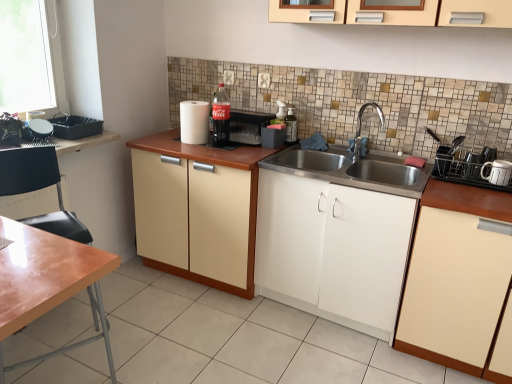
Question: Does matte plastic soda machine at center, the third appliance in the left-to-right sequence, have a lesser height compared to silver metallic faucet at center?

Choices:
 (A) no
 (B) yes

Answer: (B)

Question: Is matte plastic soda machine at center, the third appliance in the left-to-right sequence, to the left of silver metallic faucet at center from the viewer's perspective?

Choices:
 (A) yes
 (B) no

Answer: (A)

Question: From the image's perspective, is matte plastic soda machine at center, positioned as the fourth appliance in right-to-left order, below silver metallic faucet at center?

Choices:
 (A) no
 (B) yes

Answer: (A)

Question: Does matte plastic soda machine at center, positioned as the fourth appliance in right-to-left order, have a lesser width compared to silver metallic faucet at center?

Choices:
 (A) yes
 (B) no

Answer: (A)

Question: Does matte plastic soda machine at center, the third appliance in the left-to-right sequence, lie behind silver metallic faucet at center?

Choices:
 (A) yes
 (B) no

Answer: (A)

Question: Considering the positions of transparent glass bottle at upper center, acting as the 2th bottle starting from the left, and matte cream cabinet at center, the 3th cabinetry when ordered from right to left, in the image, is transparent glass bottle at upper center, acting as the 2th bottle starting from the left, wider or thinner than matte cream cabinet at center, the 3th cabinetry when ordered from right to left,?

Choices:
 (A) wide
 (B) thin

Answer: (B)

Question: Does point 290,107 appear closer or farther from the camera than point 193,269?

Choices:
 (A) closer
 (B) farther

Answer: (B)

Question: Is transparent glass bottle at upper center, acting as the 2th bottle starting from the left, in front of or behind matte cream cabinet at center, which is counted as the 1th cabinetry, starting from the left, in the image?

Choices:
 (A) front
 (B) behind

Answer: (B)

Question: Is transparent glass bottle at upper center, the 1th bottle when ordered from right to left, inside or outside of matte cream cabinet at center, the 3th cabinetry when ordered from right to left?

Choices:
 (A) inside
 (B) outside

Answer: (B)

Question: Looking at the image, does silver metallic faucet at center seem bigger or smaller compared to white matte cabinet at center, the second cabinetry positioned from the left?

Choices:
 (A) big
 (B) small

Answer: (B)

Question: Do you think silver metallic faucet at center is within white matte cabinet at center, positioned as the 2th cabinetry in right-to-left order, or outside of it?

Choices:
 (A) outside
 (B) inside

Answer: (A)

Question: From a real-world perspective, is silver metallic faucet at center above or below white matte cabinet at center, positioned as the 2th cabinetry in right-to-left order?

Choices:
 (A) below
 (B) above

Answer: (B)

Question: From their relative heights in the image, would you say silver metallic faucet at center is taller or shorter than white matte cabinet at center, positioned as the 2th cabinetry in right-to-left order?

Choices:
 (A) tall
 (B) short

Answer: (B)

Question: Based on their sizes in the image, would you say black plastic toaster at right, the second appliance in the right-to-left sequence, is bigger or smaller than silver metallic faucet at center?

Choices:
 (A) big
 (B) small

Answer: (B)

Question: Relative to silver metallic faucet at center, is black plastic toaster at right, the 5th appliance from the left, in front or behind?

Choices:
 (A) behind
 (B) front

Answer: (B)